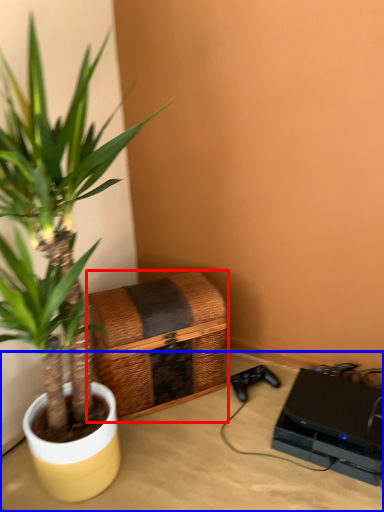
Question: Which object appears closest to the camera in this image, basket (highlighted by a red box) or table (highlighted by a blue box)?

Choices:
 (A) basket
 (B) table

Answer: (B)